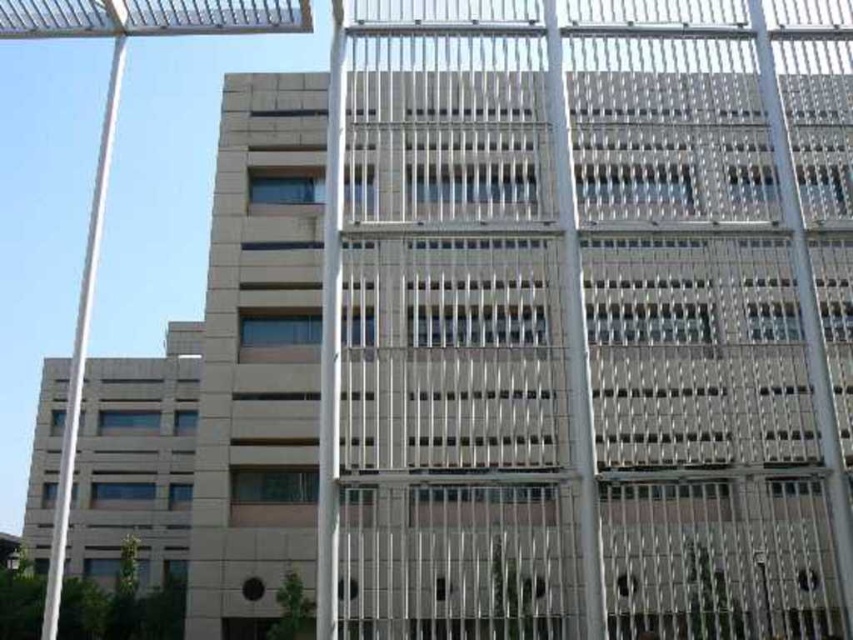
Question: Which object is farther from the camera taking this photo?

Choices:
 (A) silver metallic pole at right
 (B) white metallic pole at center
 (C) metallic silver pole at center
 (D) white metallic pole at left

Answer: (D)

Question: Among these points, which one is farthest from the camera?

Choices:
 (A) pyautogui.click(x=323, y=461)
 (B) pyautogui.click(x=833, y=502)
 (C) pyautogui.click(x=45, y=628)

Answer: (A)

Question: Does metallic silver pole at center have a smaller size compared to white metallic pole at center?

Choices:
 (A) yes
 (B) no

Answer: (A)

Question: Which point is farther to the camera?

Choices:
 (A) silver metallic pole at right
 (B) white metallic pole at center

Answer: (B)

Question: Observing the image, what is the correct spatial positioning of metallic silver pole at center in reference to white metallic pole at left?

Choices:
 (A) below
 (B) above

Answer: (B)

Question: Observing the image, what is the correct spatial positioning of white metallic pole at center in reference to white metallic pole at left?

Choices:
 (A) right
 (B) left

Answer: (A)